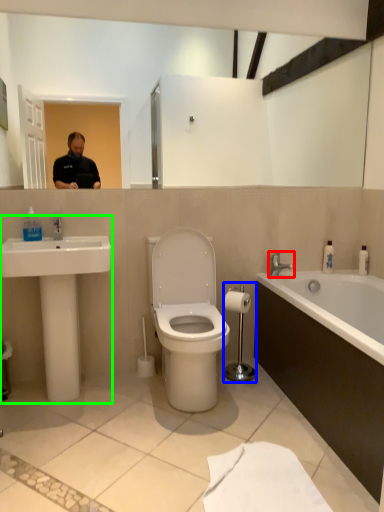
Question: Which object is the farthest from tap (highlighted by a red box)? Choose among these: towel bar (highlighted by a blue box) or sink (highlighted by a green box).

Choices:
 (A) towel bar
 (B) sink

Answer: (B)